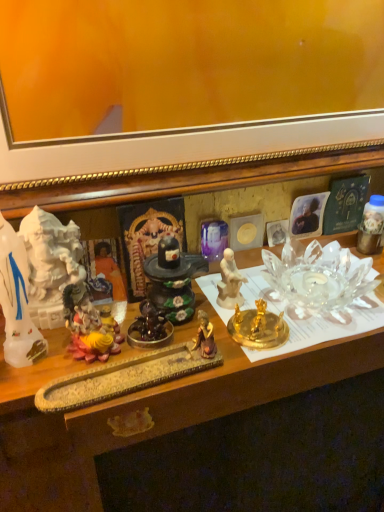
Question: Can you see matte yellow statue at center, placed as the 5th toy when sorted from right to left, touching gold metallic candle holder at center?

Choices:
 (A) no
 (B) yes

Answer: (A)

Question: From the image's perspective, is matte yellow statue at center, placed as the 5th toy when sorted from right to left, located beneath gold metallic candle holder at center?

Choices:
 (A) yes
 (B) no

Answer: (A)

Question: Is matte yellow statue at center, placed as the 2th toy when sorted from left to right, thinner than gold metallic candle holder at center?

Choices:
 (A) no
 (B) yes

Answer: (B)

Question: Are matte yellow statue at center, placed as the 5th toy when sorted from right to left, and gold metallic candle holder at center located far from each other?

Choices:
 (A) no
 (B) yes

Answer: (A)

Question: Is matte yellow statue at center, placed as the 2th toy when sorted from left to right, behind gold metallic candle holder at center?

Choices:
 (A) yes
 (B) no

Answer: (B)

Question: Is matte yellow statue at center, placed as the 2th toy when sorted from left to right, positioned in front of gold metallic candle holder at center?

Choices:
 (A) no
 (B) yes

Answer: (B)

Question: Is gold metallic candle holder at center beside matte white statue at center, the 2th person viewed from the left?

Choices:
 (A) no
 (B) yes

Answer: (B)

Question: Does gold metallic candle holder at center have a lesser width compared to matte white statue at center, the first person viewed from the right?

Choices:
 (A) yes
 (B) no

Answer: (B)

Question: Is gold metallic candle holder at center behind matte white statue at center, the 2th person viewed from the left?

Choices:
 (A) no
 (B) yes

Answer: (A)

Question: From the image's perspective, would you say gold metallic candle holder at center is positioned over matte white statue at center, the 2th person viewed from the left?

Choices:
 (A) yes
 (B) no

Answer: (B)

Question: Does gold metallic candle holder at center come in front of matte white statue at center, the first person viewed from the right?

Choices:
 (A) yes
 (B) no

Answer: (A)

Question: From a real-world perspective, is gold metallic candle holder at center positioned under matte white statue at center, the first person viewed from the right, based on gravity?

Choices:
 (A) yes
 (B) no

Answer: (A)

Question: Can you confirm if shiny dark brown statue at center, arranged as the 4th toy when viewed from the right, is positioned to the left of metallic gold figurine at right, acting as the first toy starting from the right?

Choices:
 (A) no
 (B) yes

Answer: (B)